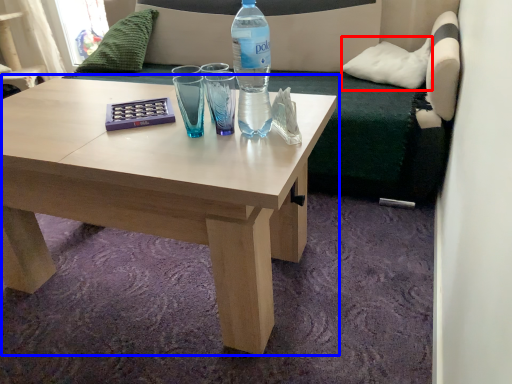
Question: Which point is further to the camera, pillow (highlighted by a red box) or coffee table (highlighted by a blue box)?

Choices:
 (A) pillow
 (B) coffee table

Answer: (A)